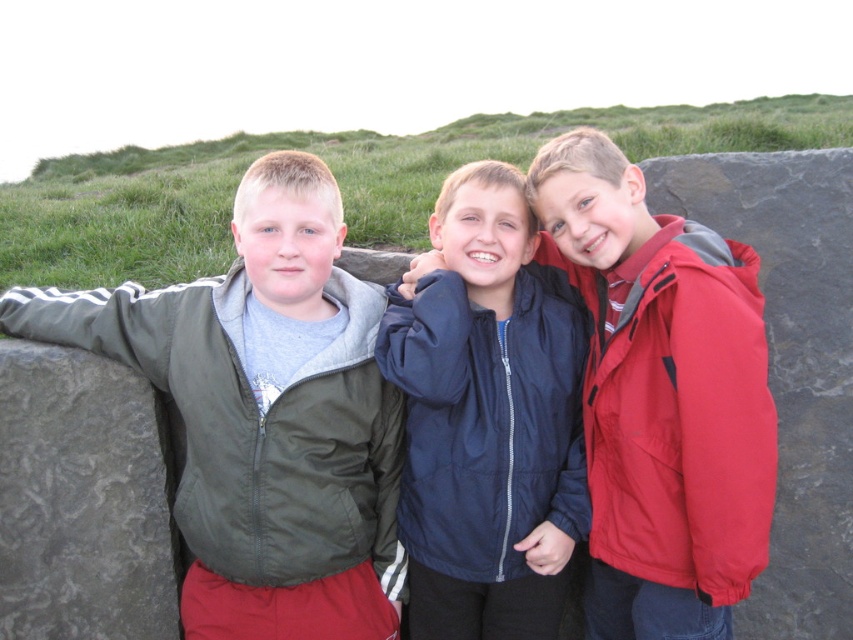
Measure the distance from green grass at upper center to gray textured stone at left.

green grass at upper center and gray textured stone at left are 4.41 meters apart from each other.

From the picture: Does green grass at upper center have a larger size compared to gray textured stone at left?

Yes.

Which is behind, point (117, 246) or point (70, 490)?

The point (117, 246) is more distant.

The height and width of the screenshot is (640, 853). In order to click on green grass at upper center in this screenshot , I will do `click(338, 182)`.

Which is in front, point (19, 193) or point (686, 428)?

Positioned in front is point (686, 428).

Can you confirm if green grass at upper center is smaller than matte red jacket at right?

Incorrect, green grass at upper center is not smaller in size than matte red jacket at right.

Where is `green grass at upper center`? Image resolution: width=853 pixels, height=640 pixels. green grass at upper center is located at coordinates (338, 182).

Can you confirm if matte green jacket at left is thinner than matte red jacket at right?

In fact, matte green jacket at left might be wider than matte red jacket at right.

Between point (364, 372) and point (753, 401), which one is positioned in front?

Positioned in front is point (753, 401).

Which is in front, point (381, 586) or point (717, 595)?

Positioned in front is point (717, 595).

Find the location of a particular element. The height and width of the screenshot is (640, 853). matte green jacket at left is located at coordinates (253, 422).